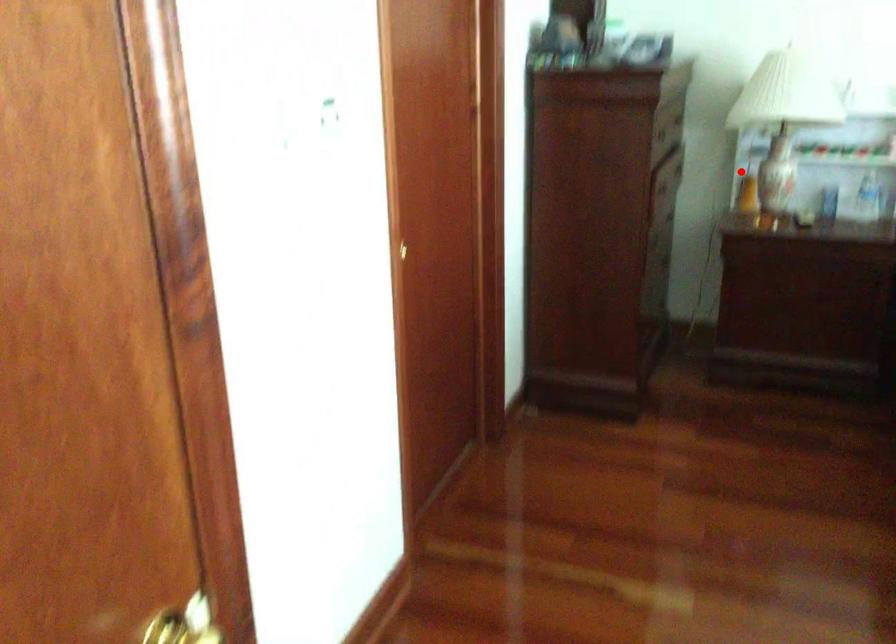
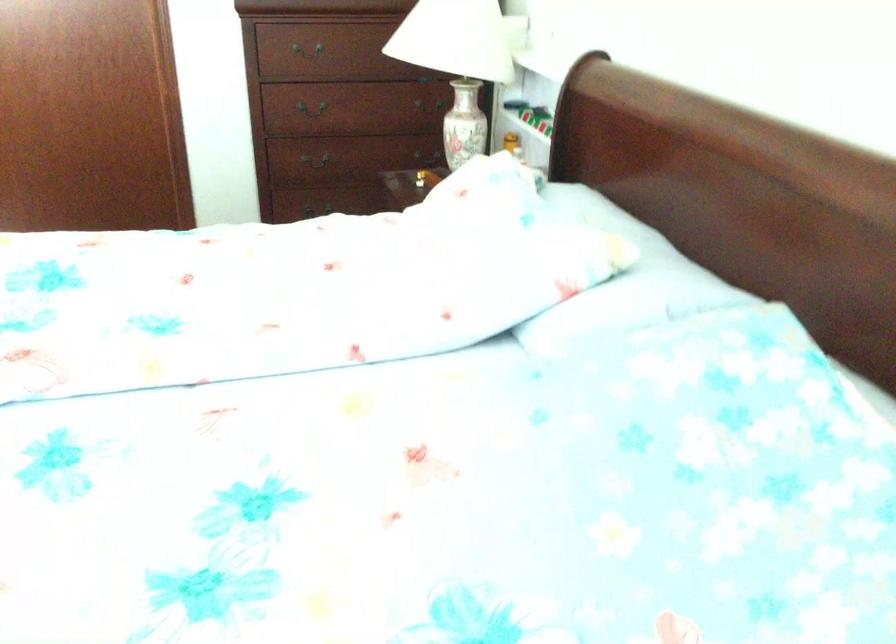
In the second image, find the point that corresponds to the highlighted location in the first image.

(463, 124)